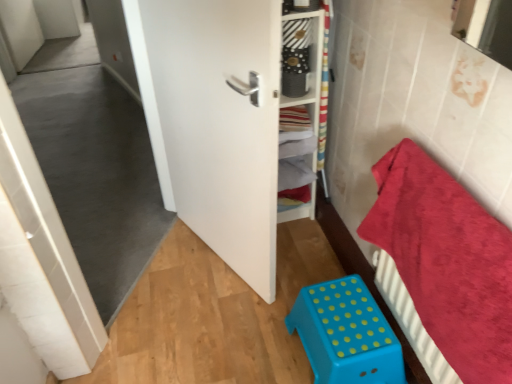
Locate an element on the screen. The image size is (512, 384). white matte door at center is located at coordinates (220, 123).

What do you see at coordinates (305, 110) in the screenshot?
I see `white wooden shelf at center` at bounding box center [305, 110].

In order to click on red plush towel at right in this screenshot , I will do `click(447, 260)`.

What do you see at coordinates (447, 260) in the screenshot? Image resolution: width=512 pixels, height=384 pixels. I see `red plush towel at right` at bounding box center [447, 260].

Locate an element on the screen. Image resolution: width=512 pixels, height=384 pixels. blue plastic stool at lower center is located at coordinates (346, 334).

Can you confirm if white wooden shelf at center is wider than white matte door at center?

Yes, white wooden shelf at center is wider than white matte door at center.

From the image's perspective, who appears lower, white wooden shelf at center or white matte door at center?

white matte door at center, from the image's perspective.

How much distance is there between white wooden shelf at center and white matte door at center?

white wooden shelf at center and white matte door at center are 43.20 centimeters apart.

From the picture: Is white wooden shelf at center taller than white matte door at center?

No.

Between blue plastic stool at lower center and red plush towel at right, which one has larger size?

Bigger between the two is red plush towel at right.

Between blue plastic stool at lower center and red plush towel at right, which one appears on the right side from the viewer's perspective?

red plush towel at right.

From the image's perspective, between blue plastic stool at lower center and red plush towel at right, who is located below?

blue plastic stool at lower center is shown below in the image.

Considering the relative sizes of blue plastic stool at lower center and red plush towel at right in the image provided, is blue plastic stool at lower center wider than red plush towel at right?

Indeed, blue plastic stool at lower center has a greater width compared to red plush towel at right.

Is white wooden shelf at center at the back of blue plastic stool at lower center?

blue plastic stool at lower center does not have its back to white wooden shelf at center.

Does blue plastic stool at lower center have a larger size compared to white wooden shelf at center?

No, blue plastic stool at lower center is not bigger than white wooden shelf at center.

From the image's perspective, which one is positioned lower, blue plastic stool at lower center or white wooden shelf at center?

blue plastic stool at lower center appears lower in the image.

Which is more to the left, blue plastic stool at lower center or white wooden shelf at center?

white wooden shelf at center.

From a real-world perspective, is red plush towel at right located higher than white wooden shelf at center?

No.

Considering the positions of objects red plush towel at right and white wooden shelf at center in the image provided, who is more to the right, red plush towel at right or white wooden shelf at center?

red plush towel at right.

Between red plush towel at right and white wooden shelf at center, which one is positioned in front?

Positioned in front is red plush towel at right.

Is red plush towel at right beside white wooden shelf at center?

No, red plush towel at right is not touching white wooden shelf at center.

Between red plush towel at right and blue plastic stool at lower center, which one has smaller size?

Smaller between the two is blue plastic stool at lower center.

Locate an element on the screen. bedding above the blue plastic stool at lower center (from the image's perspective) is located at coordinates (447, 260).

From the image's perspective, which one is positioned lower, red plush towel at right or blue plastic stool at lower center?

blue plastic stool at lower center.

Could you tell me if red plush towel at right is turned towards blue plastic stool at lower center?

Yes.

Considering the positions of objects white matte door at center and blue plastic stool at lower center in the image provided, who is more to the left, white matte door at center or blue plastic stool at lower center?

white matte door at center.

Is white matte door at center in front of or behind blue plastic stool at lower center in the image?

Clearly, white matte door at center is in front of blue plastic stool at lower center.

Would you consider white matte door at center to be distant from blue plastic stool at lower center?

Actually, white matte door at center and blue plastic stool at lower center are a little close together.

Looking at this image, from the image's perspective, which one is positioned higher, red plush towel at right or white matte door at center?

From the image's view, white matte door at center is above.

Is red plush towel at right outside of white matte door at center?

Absolutely, red plush towel at right is external to white matte door at center.

The height and width of the screenshot is (384, 512). In order to click on bedding in front of the white matte door at center in this screenshot , I will do `click(447, 260)`.

In the image, there is a white wooden shelf at center. Where is `door below it (from the image's perspective)`? door below it (from the image's perspective) is located at coordinates (220, 123).

Find the location of `bedding that appears on the right of blue plastic stool at lower center`. bedding that appears on the right of blue plastic stool at lower center is located at coordinates (447, 260).

Estimate the real-world distances between objects in this image. Which object is closer to white wooden shelf at center, red plush towel at right or white matte door at center?

white matte door at center lies closer to white wooden shelf at center than the other object.

Based on their spatial positions, is white matte door at center or white wooden shelf at center closer to blue plastic stool at lower center?

Among the two, white matte door at center is located nearer to blue plastic stool at lower center.

When comparing their distances from blue plastic stool at lower center, does white matte door at center or red plush towel at right seem closer?

red plush towel at right is closer to blue plastic stool at lower center.

Looking at the image, which one is located closer to blue plastic stool at lower center, red plush towel at right or white matte door at center?

red plush towel at right is positioned closer to the anchor blue plastic stool at lower center.

Which object lies nearer to the anchor point white wooden shelf at center, blue plastic stool at lower center or red plush towel at right?

red plush towel at right lies closer to white wooden shelf at center than the other object.

From the image, which object appears to be farther from white wooden shelf at center, white matte door at center or red plush towel at right?

red plush towel at right.

From the image, which object appears to be farther from red plush towel at right, white wooden shelf at center or blue plastic stool at lower center?

white wooden shelf at center lies further to red plush towel at right than the other object.

Estimate the real-world distances between objects in this image. Which object is closer to red plush towel at right, white matte door at center or white wooden shelf at center?

white matte door at center.

Identify the location of bedding that lies between white wooden shelf at center and blue plastic stool at lower center from top to bottom. Image resolution: width=512 pixels, height=384 pixels. (447, 260).

This screenshot has width=512, height=384. In order to click on door located between red plush towel at right and white wooden shelf at center in the depth direction in this screenshot , I will do `click(220, 123)`.

Identify the location of furniture located between white matte door at center and red plush towel at right in the left-right direction. Image resolution: width=512 pixels, height=384 pixels. (346, 334).

Where is `door between white wooden shelf at center and blue plastic stool at lower center vertically`? The height and width of the screenshot is (384, 512). door between white wooden shelf at center and blue plastic stool at lower center vertically is located at coordinates (220, 123).